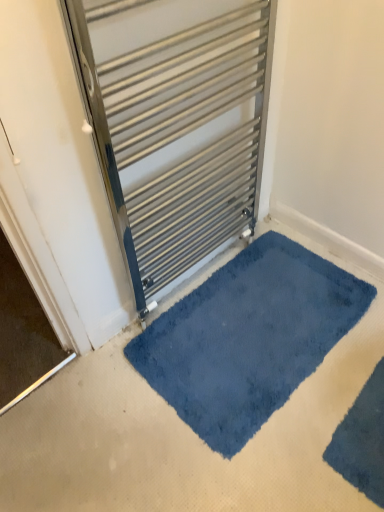
Question: From the image's perspective, is metallic silver radiator at center under velvety blue bath mat at lower right, which is the 1th bath mat from front to back?

Choices:
 (A) yes
 (B) no

Answer: (B)

Question: Considering the relative positions of metallic silver radiator at center and velvety blue bath mat at lower right, positioned as the 2th bath mat in back-to-front order, in the image provided, is metallic silver radiator at center to the left of velvety blue bath mat at lower right, positioned as the 2th bath mat in back-to-front order, from the viewer's perspective?

Choices:
 (A) no
 (B) yes

Answer: (B)

Question: Is velvety blue bath mat at lower right, positioned as the 2th bath mat in back-to-front order, surrounded by metallic silver radiator at center?

Choices:
 (A) yes
 (B) no

Answer: (B)

Question: Can you confirm if metallic silver radiator at center is smaller than velvety blue bath mat at lower right, which is the 1th bath mat from front to back?

Choices:
 (A) yes
 (B) no

Answer: (B)

Question: Does metallic silver radiator at center appear on the right side of velvety blue bath mat at lower right, which is the 1th bath mat from front to back?

Choices:
 (A) no
 (B) yes

Answer: (A)

Question: Considering the positions of metallic silver radiator at center and blue plush bath mat at center, which appears as the 1th bath mat when viewed from the back, in the image, is metallic silver radiator at center taller or shorter than blue plush bath mat at center, which appears as the 1th bath mat when viewed from the back,?

Choices:
 (A) short
 (B) tall

Answer: (B)

Question: Considering the positions of metallic silver radiator at center and blue plush bath mat at center, which appears as the 1th bath mat when viewed from the back, in the image, is metallic silver radiator at center bigger or smaller than blue plush bath mat at center, which appears as the 1th bath mat when viewed from the back,?

Choices:
 (A) small
 (B) big

Answer: (B)

Question: Relative to blue plush bath mat at center, which appears as the 1th bath mat when viewed from the back, is metallic silver radiator at center in front or behind?

Choices:
 (A) behind
 (B) front

Answer: (B)

Question: Is metallic silver radiator at center inside the boundaries of blue plush bath mat at center, which ranks as the second bath mat in front-to-back order, or outside?

Choices:
 (A) outside
 (B) inside

Answer: (A)

Question: From the image's perspective, is blue plush bath mat at center, which ranks as the second bath mat in front-to-back order, above or below velvety blue bath mat at lower right, positioned as the 2th bath mat in back-to-front order?

Choices:
 (A) below
 (B) above

Answer: (B)

Question: Which is correct: blue plush bath mat at center, which appears as the 1th bath mat when viewed from the back, is inside velvety blue bath mat at lower right, positioned as the 2th bath mat in back-to-front order, or outside of it?

Choices:
 (A) outside
 (B) inside

Answer: (A)

Question: Considering their positions, is blue plush bath mat at center, which appears as the 1th bath mat when viewed from the back, located in front of or behind velvety blue bath mat at lower right, positioned as the 2th bath mat in back-to-front order?

Choices:
 (A) behind
 (B) front

Answer: (A)

Question: Considering the positions of blue plush bath mat at center, which ranks as the second bath mat in front-to-back order, and velvety blue bath mat at lower right, positioned as the 2th bath mat in back-to-front order, in the image, is blue plush bath mat at center, which ranks as the second bath mat in front-to-back order, taller or shorter than velvety blue bath mat at lower right, positioned as the 2th bath mat in back-to-front order,?

Choices:
 (A) tall
 (B) short

Answer: (B)

Question: Considering the positions of blue plush bath mat at center, which ranks as the second bath mat in front-to-back order, and metallic silver radiator at center in the image, is blue plush bath mat at center, which ranks as the second bath mat in front-to-back order, wider or thinner than metallic silver radiator at center?

Choices:
 (A) wide
 (B) thin

Answer: (A)

Question: Is blue plush bath mat at center, which appears as the 1th bath mat when viewed from the back, spatially inside metallic silver radiator at center, or outside of it?

Choices:
 (A) inside
 (B) outside

Answer: (B)